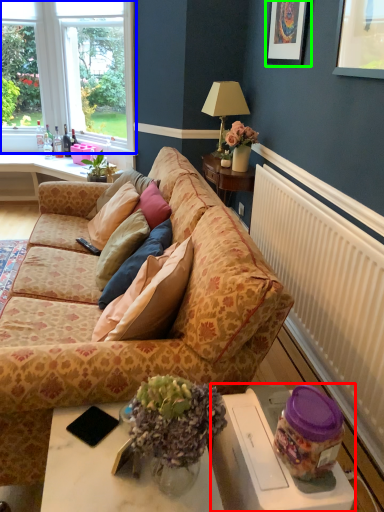
Question: Based on their relative distances, which object is farther from wide (highlighted by a red box)? Choose from window (highlighted by a blue box) and picture frame (highlighted by a green box).

Choices:
 (A) window
 (B) picture frame

Answer: (A)